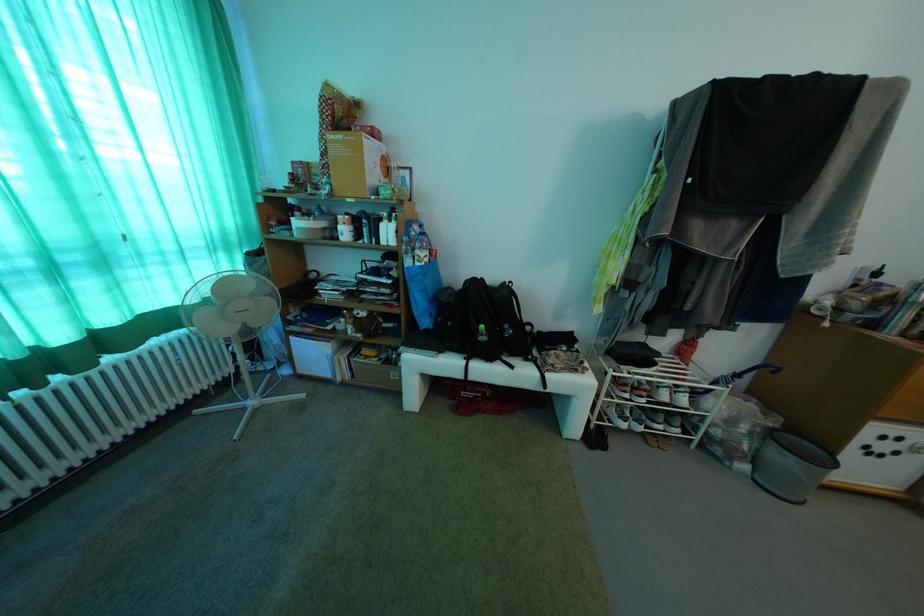
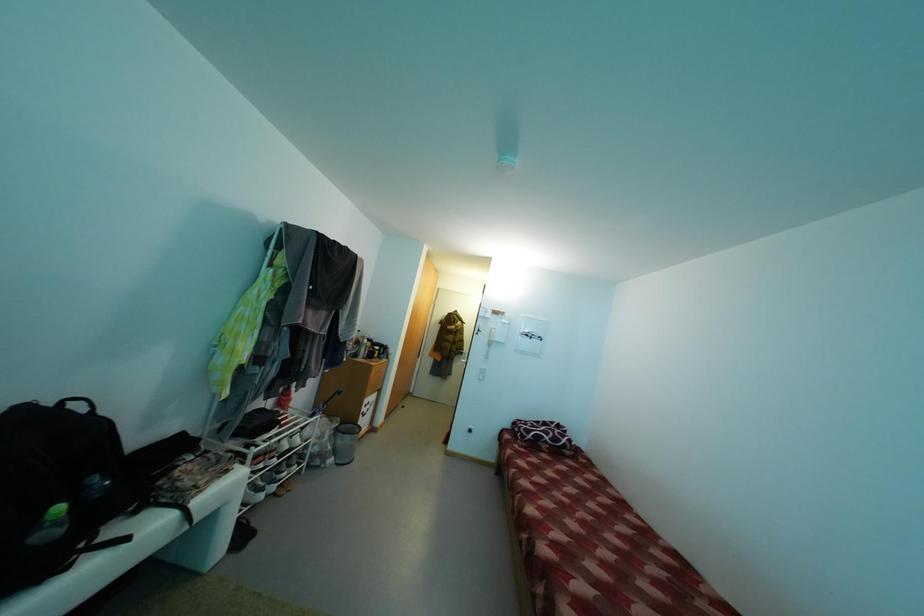
Question: How did the camera likely rotate?

Choices:
 (A) Left
 (B) Right
 (C) Up
 (D) Down

Answer: (B)